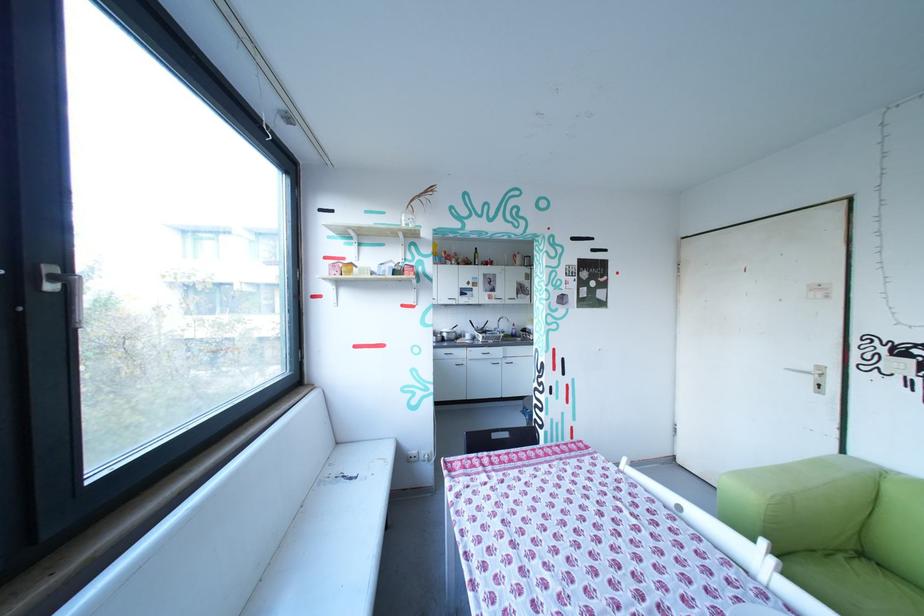
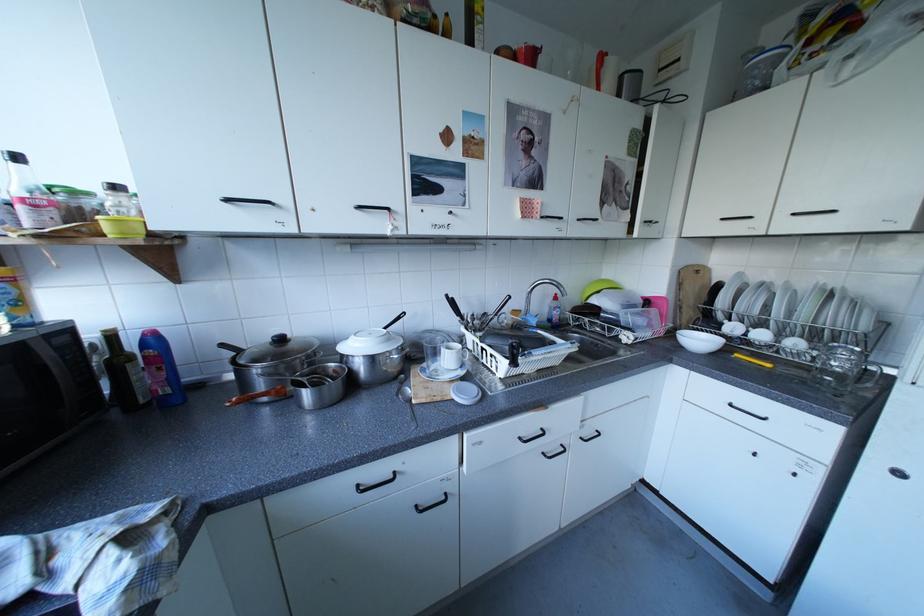
Question: Which direction would the cameraman need to move to produce the second image? Reply with the corresponding letter.

Choices:
 (A) Left
 (B) Right
 (C) Forward
 (D) Backward

Answer: (C)